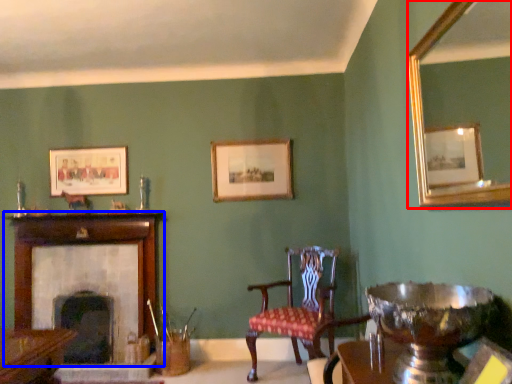
Question: Which object appears closest to the camera in this image, mirror (highlighted by a red box) or fireplace (highlighted by a blue box)?

Choices:
 (A) mirror
 (B) fireplace

Answer: (A)